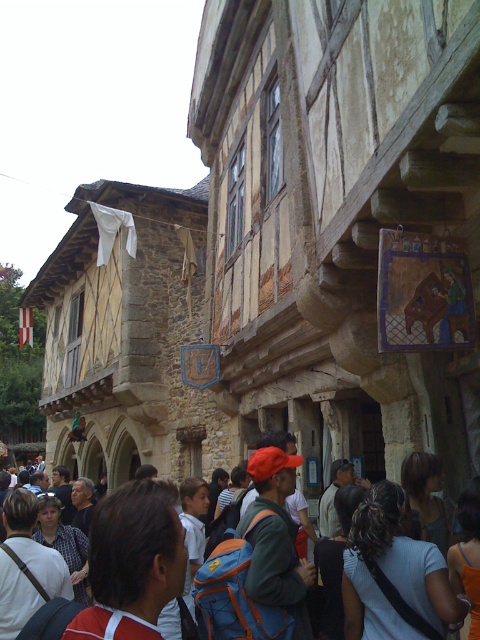
Question: Is white cotton shirt at center wider than orange fabric shirt at lower right?

Choices:
 (A) no
 (B) yes

Answer: (B)

Question: Is curly hair at center to the right of dark blue shirt at center from the viewer's perspective?

Choices:
 (A) no
 (B) yes

Answer: (B)

Question: Among these objects, which one is farthest from the camera?

Choices:
 (A) orange fabric shirt at lower right
 (B) dark brown hair at center
 (C) brown fabric shirt at center

Answer: (C)

Question: Which of the following is the farthest from the observer?

Choices:
 (A) brown fabric shirt at center
 (B) reddish-brown backpack at center

Answer: (A)

Question: Does curly hair at center have a larger size compared to orange fabric cap at center?

Choices:
 (A) yes
 (B) no

Answer: (B)

Question: Which of the following is the farthest from the observer?

Choices:
 (A) (27, 602)
 (B) (294, 600)

Answer: (A)